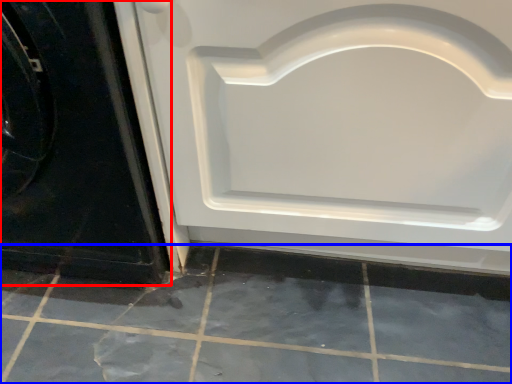
Question: Which of the following is the closest to the observer, door (highlighted by a red box) or ceramic tile (highlighted by a blue box)?

Choices:
 (A) door
 (B) ceramic tile

Answer: (A)